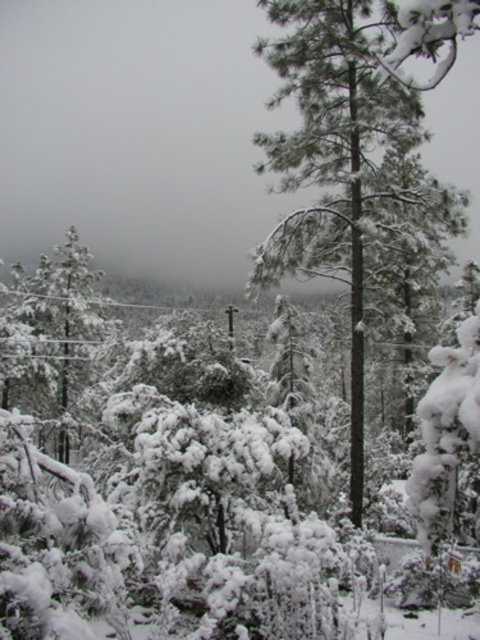
Question: Does green textured pine tree at center have a greater width compared to snow-covered evergreen tree at left?

Choices:
 (A) no
 (B) yes

Answer: (A)

Question: Which point is closer to the camera?

Choices:
 (A) (377, 76)
 (B) (38, 324)

Answer: (A)

Question: From the image, what is the correct spatial relationship of green textured pine tree at center in relation to snow-covered evergreen tree at left?

Choices:
 (A) above
 (B) below

Answer: (B)

Question: Is green textured pine tree at center to the right of snow-covered evergreen tree at left from the viewer's perspective?

Choices:
 (A) yes
 (B) no

Answer: (A)